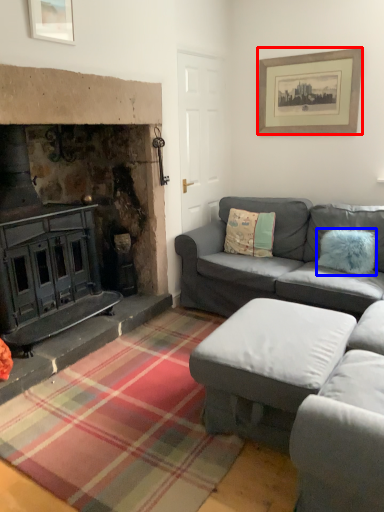
Question: Which object is further to the camera taking this photo, picture frame (highlighted by a red box) or pillow (highlighted by a blue box)?

Choices:
 (A) picture frame
 (B) pillow

Answer: (A)